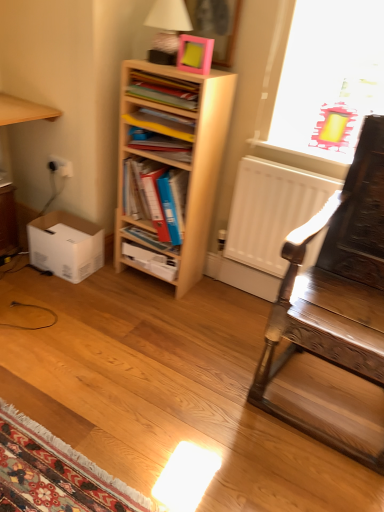
Identify the location of vacant area that is in front of light wood bookshelf at center. (157, 308).